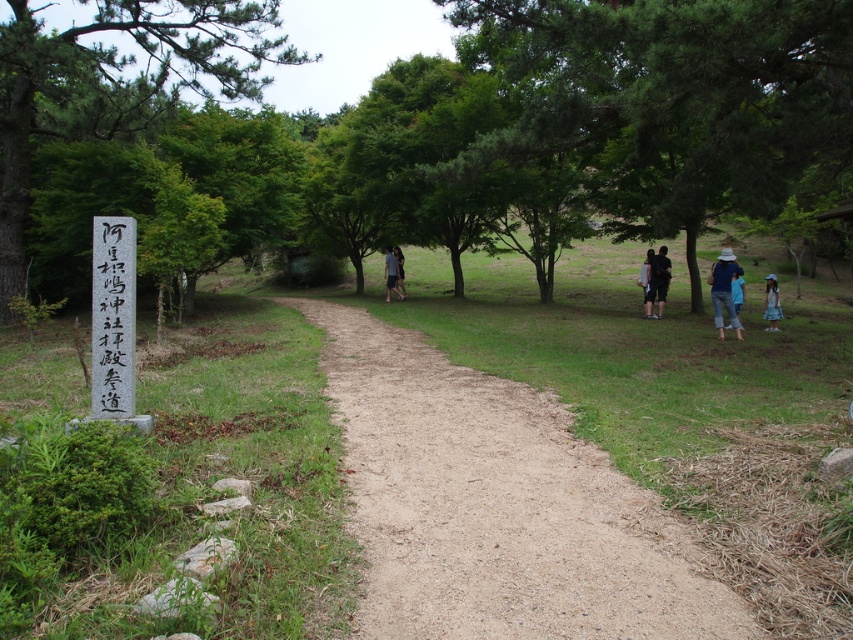
Which is below, green leafy tree at right or white wood sign at left?

white wood sign at left is lower down.

Locate an element on the screen. green leafy tree at right is located at coordinates (675, 100).

The height and width of the screenshot is (640, 853). What are the coordinates of `green leafy tree at right` in the screenshot? It's located at [675, 100].

Between point (111, 416) and point (722, 280), which one is positioned in front?

Point (111, 416) is in front.

Is white wood sign at left wider than denim hat at right?

In fact, white wood sign at left might be narrower than denim hat at right.

Who is more forward, (125,326) or (711,284)?

Point (125,326) is in front.

Where is `white wood sign at left`? This screenshot has height=640, width=853. white wood sign at left is located at coordinates (112, 316).

Image resolution: width=853 pixels, height=640 pixels. What do you see at coordinates (723, 291) in the screenshot?
I see `denim hat at right` at bounding box center [723, 291].

Between point (733, 273) and point (660, 246), which one is positioned in front?

Positioned in front is point (733, 273).

Identify the location of denim hat at right. This screenshot has width=853, height=640. (723, 291).